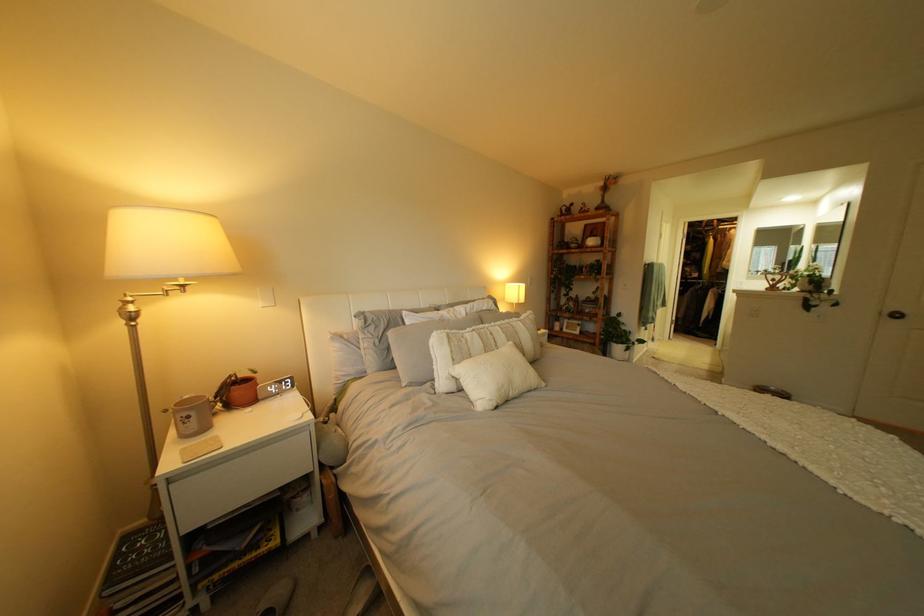
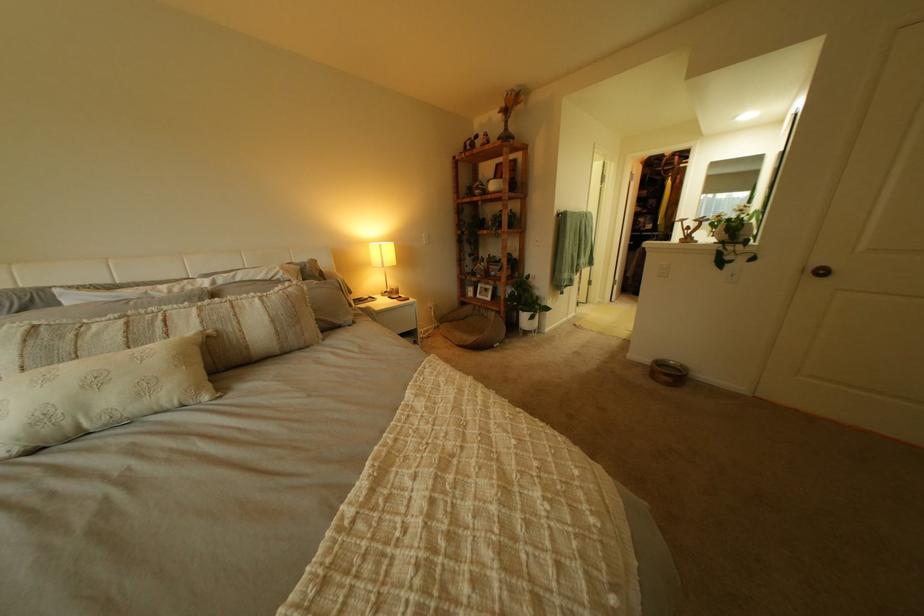
Where in the second image is the point corresponding to point (592, 241) from the first image?

(497, 185)